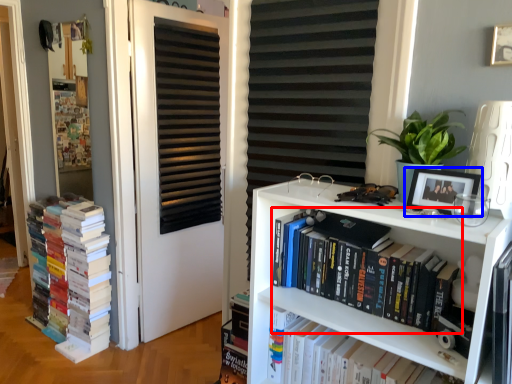
Question: Which of the following is the closest to the observer, book (highlighted by a red box) or picture frame (highlighted by a blue box)?

Choices:
 (A) book
 (B) picture frame

Answer: (B)